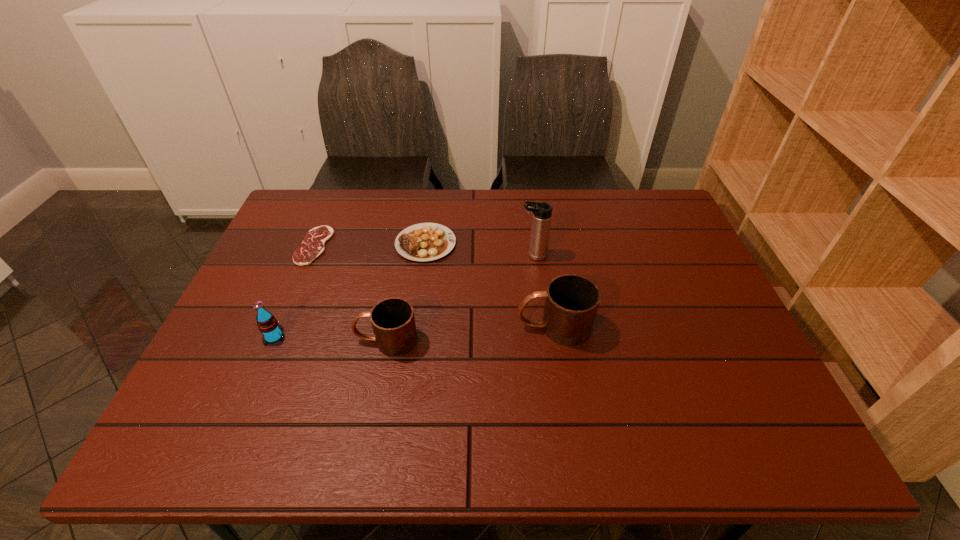
The width and height of the screenshot is (960, 540). In order to click on vacant spot to place a mug on the right in this screenshot , I will do `click(711, 314)`.